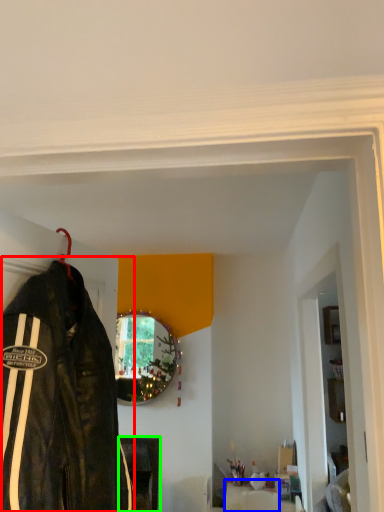
Question: Considering the real-world distances, which object is farthest from jacket (highlighted by a red box)? furniture (highlighted by a blue box) or furniture (highlighted by a green box)?

Choices:
 (A) furniture
 (B) furniture

Answer: (B)